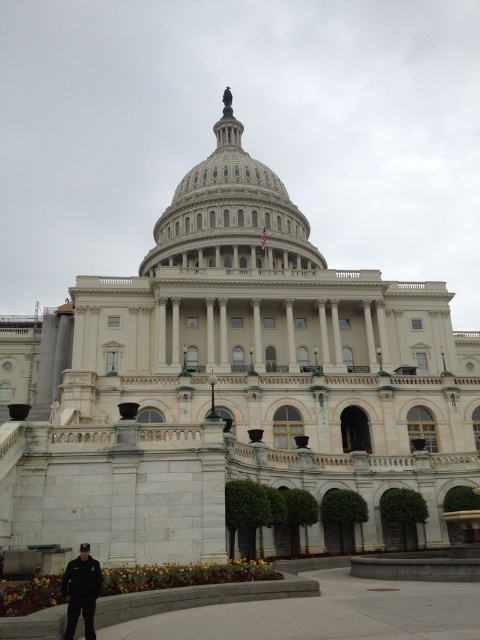
Does white marble dome at center appear on the left side of dark blue uniform at lower left?

No, white marble dome at center is not to the left of dark blue uniform at lower left.

Between point (216, 237) and point (72, 579), which one is positioned in front?

Point (72, 579) is in front.

Image resolution: width=480 pixels, height=640 pixels. Find the location of `white marble dome at center`. white marble dome at center is located at coordinates (230, 212).